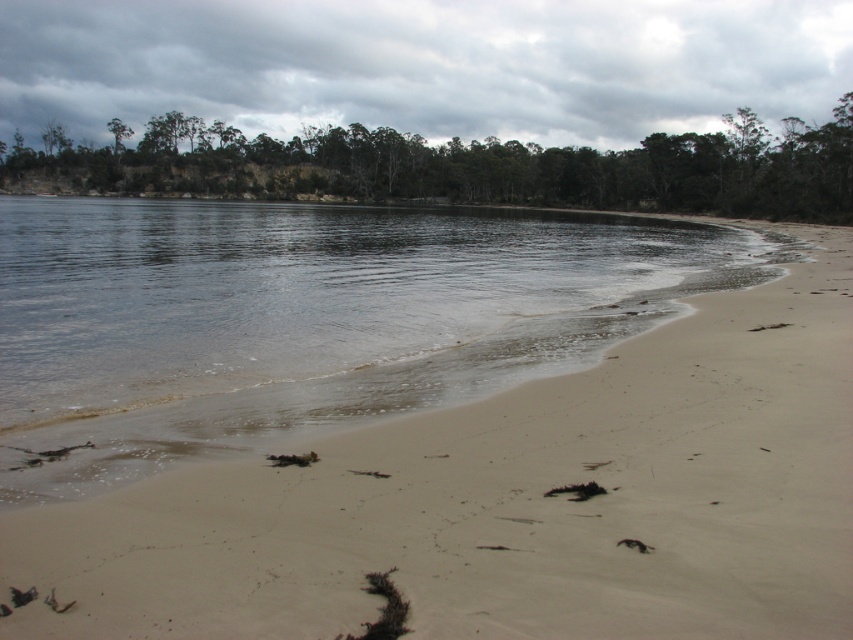
Can you confirm if light beige sand at lower right is positioned below green leafy trees at upper center?

Correct, light beige sand at lower right is located below green leafy trees at upper center.

Is light beige sand at lower right smaller than green leafy trees at upper center?

Indeed, light beige sand at lower right has a smaller size compared to green leafy trees at upper center.

Measure the distance between light beige sand at lower right and camera.

light beige sand at lower right is 12.76 feet from camera.

The width and height of the screenshot is (853, 640). I want to click on light beige sand at lower right, so click(x=512, y=500).

Does clear water at center have a lesser height compared to green leafy trees at upper center?

Yes.

Between clear water at center and green leafy trees at upper center, which one has more height?

green leafy trees at upper center

Where is `clear water at center`? clear water at center is located at coordinates (321, 300).

You are a GUI agent. You are given a task and a screenshot of the screen. Output one action in this format:
    pyautogui.click(x=<x>, y=<y>)
    Task: Click on the clear water at center
    
    Given the screenshot: What is the action you would take?
    (x=321, y=300)

Describe the element at coordinates (512, 500) in the screenshot. I see `light beige sand at lower right` at that location.

Measure the distance between light beige sand at lower right and camera.

light beige sand at lower right and camera are 3.89 meters apart.

Who is more distant from viewer, (474, 492) or (158, 284)?

The point (158, 284) is more distant.

Where is `light beige sand at lower right`? The image size is (853, 640). light beige sand at lower right is located at coordinates (512, 500).